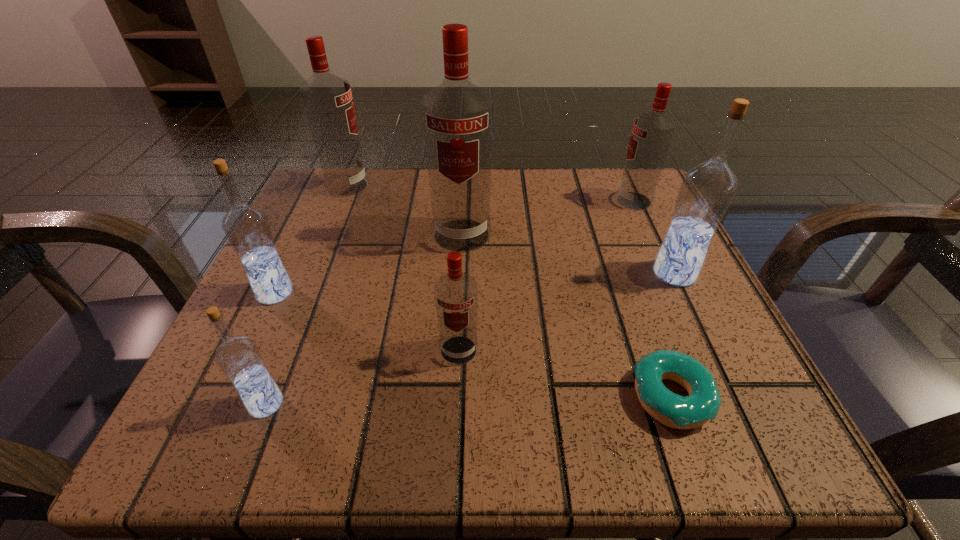
Find the location of `the biggest red vodka`. the biggest red vodka is located at coordinates (457, 116).

Locate an element on the screen. This screenshot has height=540, width=960. the third farthest object is located at coordinates (457, 116).

Locate an element on the screen. the leftmost red vodka is located at coordinates [327, 99].

The image size is (960, 540). What are the coordinates of `the biggest blue vodka` in the screenshot? It's located at (707, 189).

Image resolution: width=960 pixels, height=540 pixels. I want to click on the rightmost red vodka, so click(x=652, y=132).

Locate an element on the screen. the second biggest blue vodka is located at coordinates (246, 227).

Where is `the nearest red vodka`? The width and height of the screenshot is (960, 540). the nearest red vodka is located at coordinates (456, 293).

What are the coordinates of `the second nearest vodka` in the screenshot? It's located at pyautogui.click(x=456, y=293).

At what (x,y) coordinates should I click in order to perform the action: click on the smallest blue vodka. Please return your answer as a coordinate pair (x, y). The width and height of the screenshot is (960, 540). Looking at the image, I should click on (x=238, y=357).

This screenshot has width=960, height=540. I want to click on the nearest blue vodka, so click(238, 357).